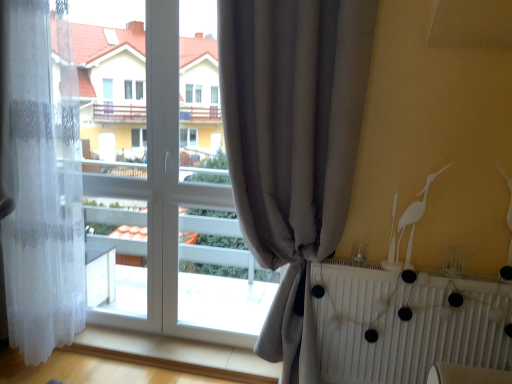
Question: Considering their positions, is white lace curtain at left, the 1th curtain viewed from the left, located in front of or behind white matte radiator at lower right?

Choices:
 (A) front
 (B) behind

Answer: (A)

Question: In terms of height, does white lace curtain at left, the 1th curtain viewed from the left, look taller or shorter compared to white matte radiator at lower right?

Choices:
 (A) short
 (B) tall

Answer: (B)

Question: Which of these objects is positioned closest to the white matte radiator at lower right?

Choices:
 (A) gray fabric curtain at center, marked as the second curtain in a left-to-right arrangement
 (B) white matte bird at upper right
 (C) white lace curtain at left, the 1th curtain viewed from the left

Answer: (B)

Question: Estimate the real-world distances between objects in this image. Which object is farther from the white lace curtain at left, the 1th curtain viewed from the left?

Choices:
 (A) white matte radiator at lower right
 (B) white matte bird at upper right
 (C) gray fabric curtain at center, marked as the second curtain in a left-to-right arrangement

Answer: (B)